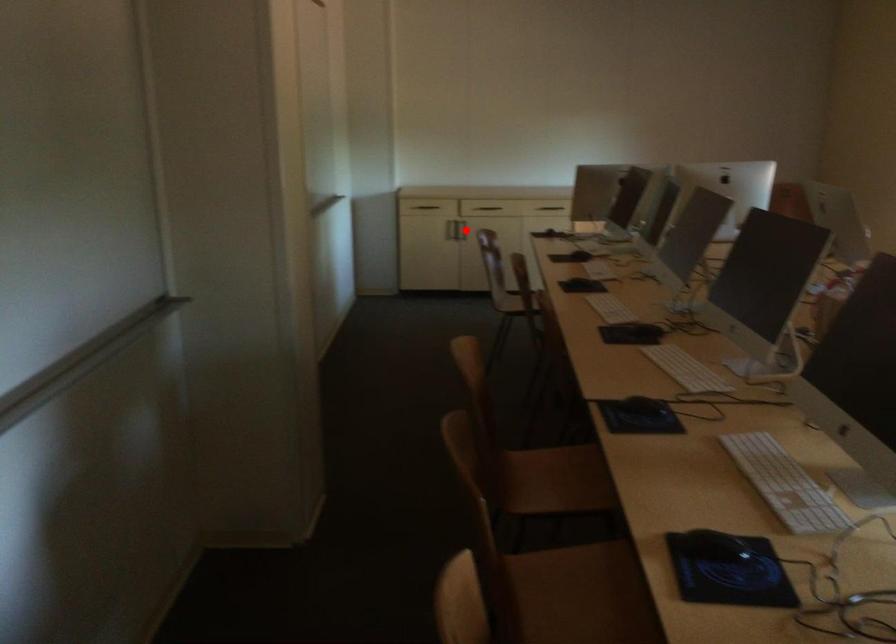
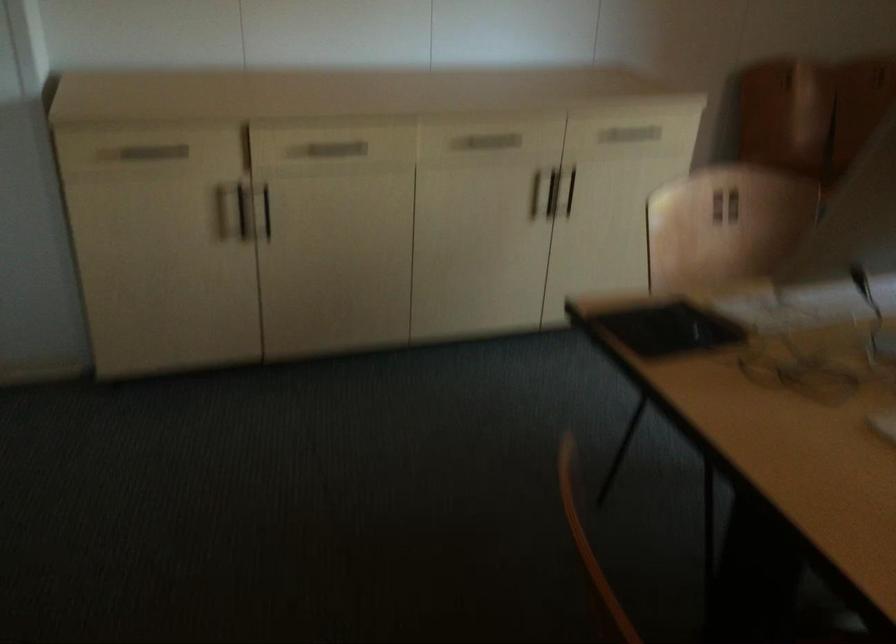
Question: I am providing you with two images of the same scene from different viewpoints. A red point is marked on the first image. At the location where the point appears in image 1, is it still visible in image 2?

Choices:
 (A) Yes
 (B) No

Answer: (B)